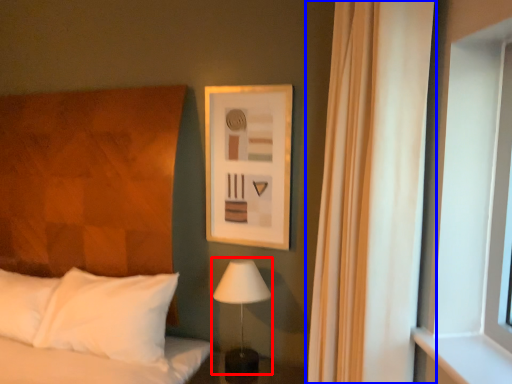
Question: Which object appears farthest to the camera in this image, table lamp (highlighted by a red box) or curtain (highlighted by a blue box)?

Choices:
 (A) table lamp
 (B) curtain

Answer: (A)